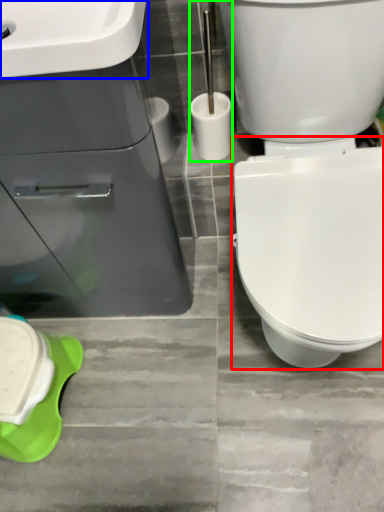
Question: Estimate the real-world distances between objects in this image. Which object is farther from bidet (highlighted by a red box), sink (highlighted by a blue box) or brush (highlighted by a green box)?

Choices:
 (A) sink
 (B) brush

Answer: (A)